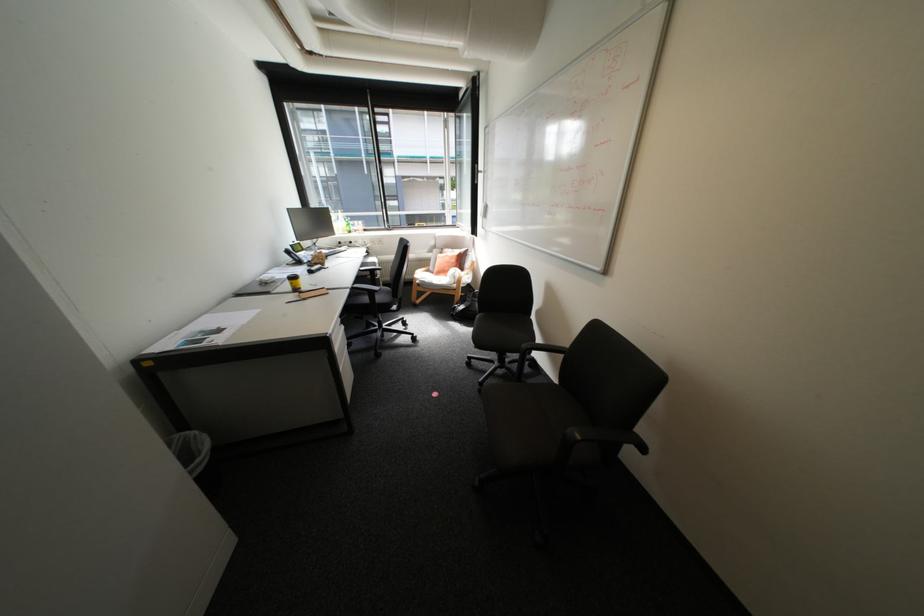
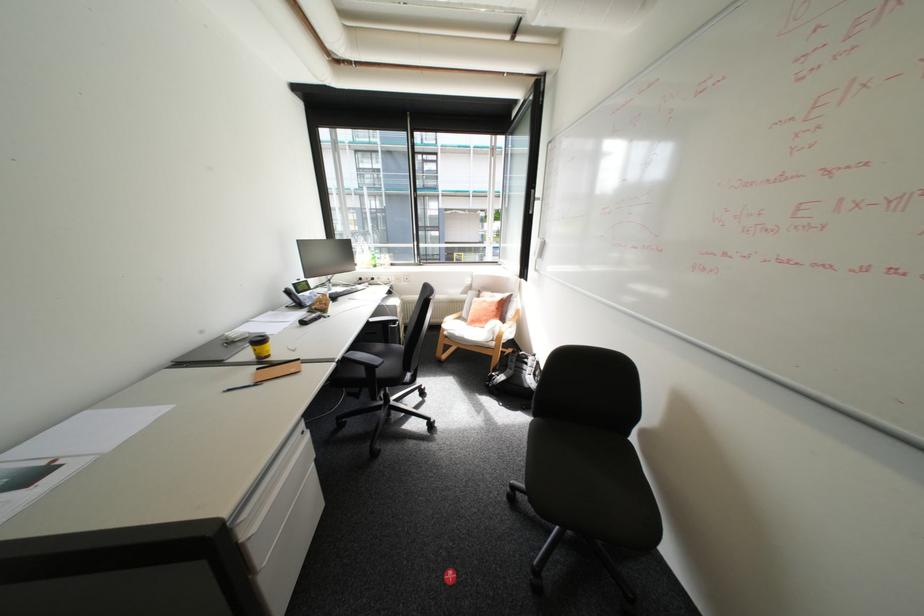
Question: The images are taken continuously from a first-person perspective. In which direction are you moving?

Choices:
 (A) Left
 (B) Right
 (C) Forward
 (D) Backward

Answer: (C)